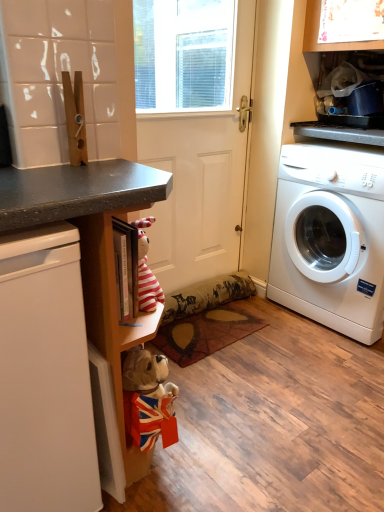
Where is `vacant area that lies between white plastic washing machine at right and patterned fabric mat at center`? Image resolution: width=384 pixels, height=512 pixels. vacant area that lies between white plastic washing machine at right and patterned fabric mat at center is located at coordinates (273, 342).